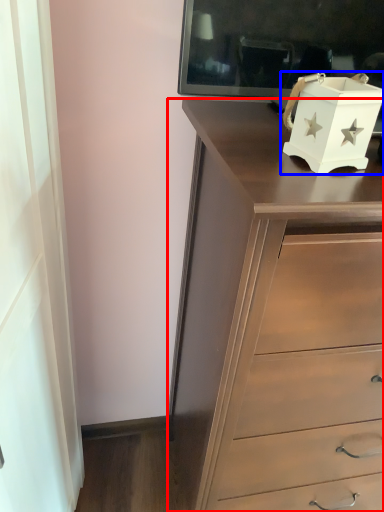
Question: Among these objects, which one is nearest to the camera, chest of drawers (highlighted by a red box) or box (highlighted by a blue box)?

Choices:
 (A) chest of drawers
 (B) box

Answer: (A)